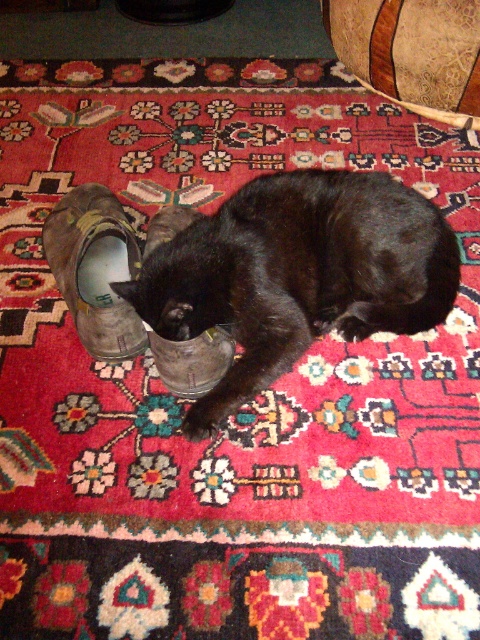
Question: Does black matte fur cat at center appear on the right side of leather/matte shoe at left?

Choices:
 (A) yes
 (B) no

Answer: (A)

Question: Does black matte fur cat at center appear under leather/matte shoe at left?

Choices:
 (A) yes
 (B) no

Answer: (A)

Question: Which object appears closest to the camera in this image?

Choices:
 (A) black matte fur cat at center
 (B) leather/matte shoe at left

Answer: (A)

Question: Which of the following is the closest to the observer?

Choices:
 (A) (391, 250)
 (B) (98, 332)

Answer: (A)

Question: Considering the relative positions of black matte fur cat at center and leather/matte shoe at left in the image provided, where is black matte fur cat at center located with respect to leather/matte shoe at left?

Choices:
 (A) right
 (B) left

Answer: (A)